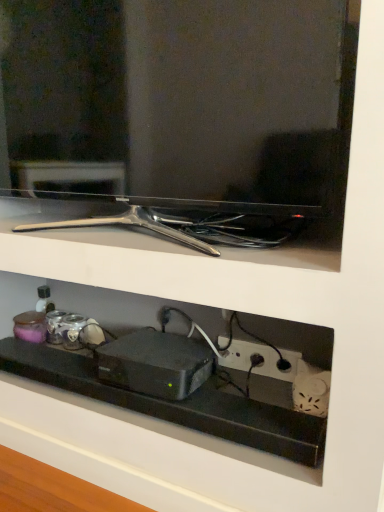
In order to face black plastic power outlet at lower right, should I rotate leftwards or rightwards?

You should rotate right by 8.666 degrees.

Where is `black plastic power outlet at lower right`? This screenshot has width=384, height=512. black plastic power outlet at lower right is located at coordinates (263, 357).

Where is `matte black tv at upper center`? matte black tv at upper center is located at coordinates (181, 115).

Who is more distant, black plastic shelf at lower center or matte black tv at upper center?

Positioned behind is black plastic shelf at lower center.

Considering the sizes of objects black plastic shelf at lower center and matte black tv at upper center in the image provided, who is wider, black plastic shelf at lower center or matte black tv at upper center?

With larger width is black plastic shelf at lower center.

Is black plastic shelf at lower center placed right next to matte black tv at upper center?

No, black plastic shelf at lower center is not making contact with matte black tv at upper center.

From a real-world perspective, between black plastic shelf at lower center and matte black tv at upper center, who is vertically higher?

matte black tv at upper center, from a real-world perspective.

Can you confirm if matte black tv at upper center is taller than black plastic shelf at lower center?

Yes.

Can you tell me how much matte black tv at upper center and black plastic shelf at lower center differ in facing direction?

There is a 1.92-degree angle between the facing directions of matte black tv at upper center and black plastic shelf at lower center.

Find the location of `shelf that is under the matte black tv at upper center (from a real-world perspective)`. shelf that is under the matte black tv at upper center (from a real-world perspective) is located at coordinates (148, 389).

From the image's perspective, is matte black tv at upper center located beneath black plastic shelf at lower center?

Incorrect, from the image's perspective, matte black tv at upper center is higher than black plastic shelf at lower center.

From the image's perspective, is matte black tv at upper center above black plastic power outlet at lower right?

Yes, from the image's perspective, matte black tv at upper center is above black plastic power outlet at lower right.

From the picture: Considering the positions of objects matte black tv at upper center and black plastic power outlet at lower right in the image provided, who is behind, matte black tv at upper center or black plastic power outlet at lower right?

black plastic power outlet at lower right.

Where is `electric outlet that appears on the right of matte black tv at upper center`? The width and height of the screenshot is (384, 512). electric outlet that appears on the right of matte black tv at upper center is located at coordinates (263, 357).

Is matte black tv at upper center not close to black plastic power outlet at lower right?

Actually, matte black tv at upper center and black plastic power outlet at lower right are a little close together.

Which object is positioned more to the left, black plastic device at center or matte black tv at upper center?

Positioned to the left is matte black tv at upper center.

What's the angular difference between black plastic device at center and matte black tv at upper center's facing directions?

There is a 6.37-degree angle between the facing directions of black plastic device at center and matte black tv at upper center.

Which of these two, black plastic device at center or matte black tv at upper center, is wider?

black plastic device at center is wider.

Between black plastic device at center and matte black tv at upper center, which one has less height?

black plastic device at center.

Considering the relative sizes of matte black tv at upper center and black plastic device at center in the image provided, is matte black tv at upper center shorter than black plastic device at center?

No.

Is matte black tv at upper center positioned beyond the bounds of black plastic device at center?

Yes.

Can you confirm if matte black tv at upper center is thinner than black plastic device at center?

Yes, matte black tv at upper center is thinner than black plastic device at center.

Identify the location of tv show that is above the black plastic device at center (from a real-world perspective). This screenshot has width=384, height=512. (181, 115).

From a real-world perspective, who is located lower, black plastic device at center or black plastic shelf at lower center?

From a 3D spatial view, black plastic shelf at lower center is below.

Is point (121, 357) positioned after point (193, 409)?

That is True.

Which of these two, black plastic device at center or black plastic shelf at lower center, stands taller?

black plastic device at center.

Are black plastic device at center and black plastic shelf at lower center making contact?

No, black plastic device at center is not making contact with black plastic shelf at lower center.

Is black plastic power outlet at lower right positioned with its back to black plastic shelf at lower center?

No, black plastic shelf at lower center is not at the back of black plastic power outlet at lower right.

How different are the orientations of black plastic power outlet at lower right and black plastic shelf at lower center in degrees?

The facing directions of black plastic power outlet at lower right and black plastic shelf at lower center are 0.000509 degrees apart.

Is black plastic power outlet at lower right to the left of black plastic shelf at lower center from the viewer's perspective?

No.

Locate an element on the screen. This screenshot has height=512, width=384. tv show above the black plastic shelf at lower center (from a real-world perspective) is located at coordinates (181, 115).

The height and width of the screenshot is (512, 384). In order to click on tv show above the black plastic shelf at lower center (from the image's perspective) in this screenshot , I will do `click(181, 115)`.

Considering their positions, is black plastic shelf at lower center positioned further to black plastic power outlet at lower right than black plastic device at center?

black plastic shelf at lower center.

Estimate the real-world distances between objects in this image. Which object is further from matte black tv at upper center, black plastic power outlet at lower right or black plastic device at center?

Among the two, black plastic power outlet at lower right is located further to matte black tv at upper center.

From the image, which object appears to be nearer to black plastic shelf at lower center, black plastic power outlet at lower right or matte black tv at upper center?

black plastic power outlet at lower right.

Based on their spatial positions, is black plastic power outlet at lower right or matte black tv at upper center further from black plastic device at center?

matte black tv at upper center is further to black plastic device at center.

When comparing their distances from black plastic power outlet at lower right, does black plastic shelf at lower center or matte black tv at upper center seem closer?

Based on the image, black plastic shelf at lower center appears to be nearer to black plastic power outlet at lower right.

Which object lies further to the anchor point black plastic shelf at lower center, matte black tv at upper center or black plastic device at center?

The object further to black plastic shelf at lower center is matte black tv at upper center.

Considering their positions, is black plastic device at center positioned further to matte black tv at upper center than black plastic power outlet at lower right?

Among the two, black plastic power outlet at lower right is located further to matte black tv at upper center.

From the image, which object appears to be farther from black plastic device at center, black plastic shelf at lower center or black plastic power outlet at lower right?

Among the two, black plastic power outlet at lower right is located further to black plastic device at center.

Where is `appliance situated between black plastic shelf at lower center and black plastic power outlet at lower right from left to right`? This screenshot has width=384, height=512. appliance situated between black plastic shelf at lower center and black plastic power outlet at lower right from left to right is located at coordinates (155, 364).

Find the location of a particular element. This screenshot has width=384, height=512. appliance between matte black tv at upper center and black plastic shelf at lower center in the up-down direction is located at coordinates (155, 364).

This screenshot has height=512, width=384. I want to click on electric outlet between matte black tv at upper center and black plastic shelf at lower center in the vertical direction, so click(263, 357).

The height and width of the screenshot is (512, 384). What are the coordinates of `appliance between matte black tv at upper center and black plastic power outlet at lower right in the vertical direction` in the screenshot? It's located at (155, 364).